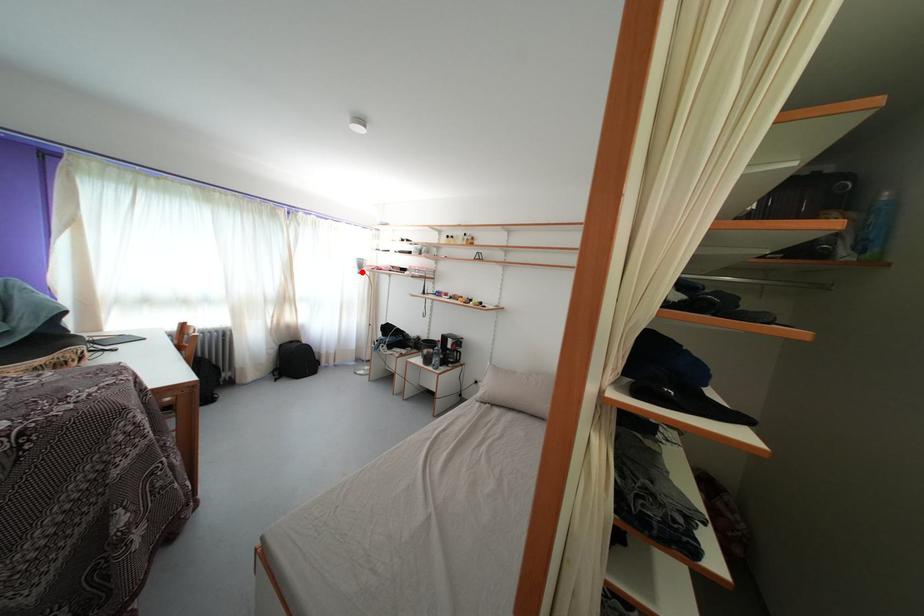
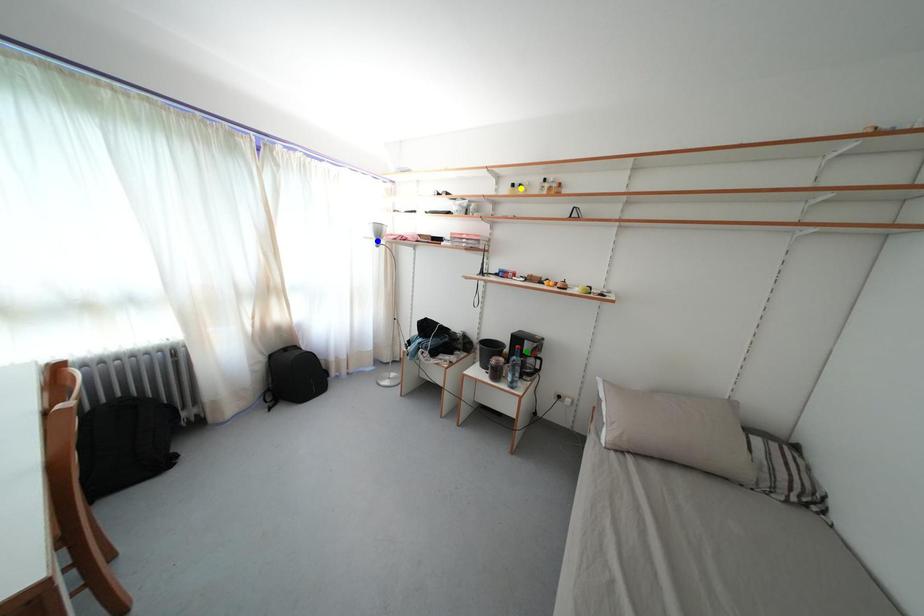
Question: I am providing you with two images of the same scene from different viewpoints. A red point is marked on the first image. You are given multiple points on the second image. Which point in image 2 is actually the same real-world point as the red point in image 1?

Choices:
 (A) green point
 (B) blue point
 (C) yellow point

Answer: (B)